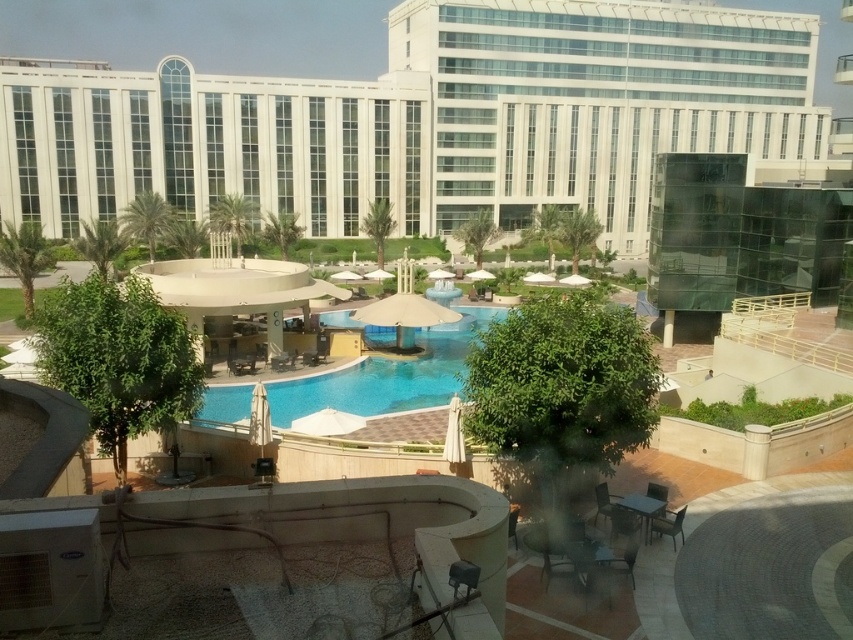
Question: From the image, what is the correct spatial relationship of white glass building at upper center in relation to metallic silver chair at lower center?

Choices:
 (A) right
 (B) left

Answer: (B)

Question: Can you confirm if blue glossy swimming pool at center is positioned to the right of metallic gray chair at lower center?

Choices:
 (A) no
 (B) yes

Answer: (A)

Question: Can you confirm if metallic gray chair at lower center is smaller than metallic silver chair at lower right?

Choices:
 (A) yes
 (B) no

Answer: (A)

Question: Which object is the farthest from the wooden chair at lower right?

Choices:
 (A) matte black chair at lower center
 (B) metallic silver chair at lower right

Answer: (B)

Question: Estimate the real-world distances between objects in this image. Which object is farther from the white glass building at upper center?

Choices:
 (A) metallic silver chair at lower center
 (B) blue glossy swimming pool at center
 (C) brown woven chair at lower right
 (D) metallic silver chair at lower right

Answer: (C)

Question: Which object is closer to the camera taking this photo?

Choices:
 (A) metallic silver chair at lower center
 (B) blue glossy swimming pool at center
 (C) metallic gray chair at lower center

Answer: (C)